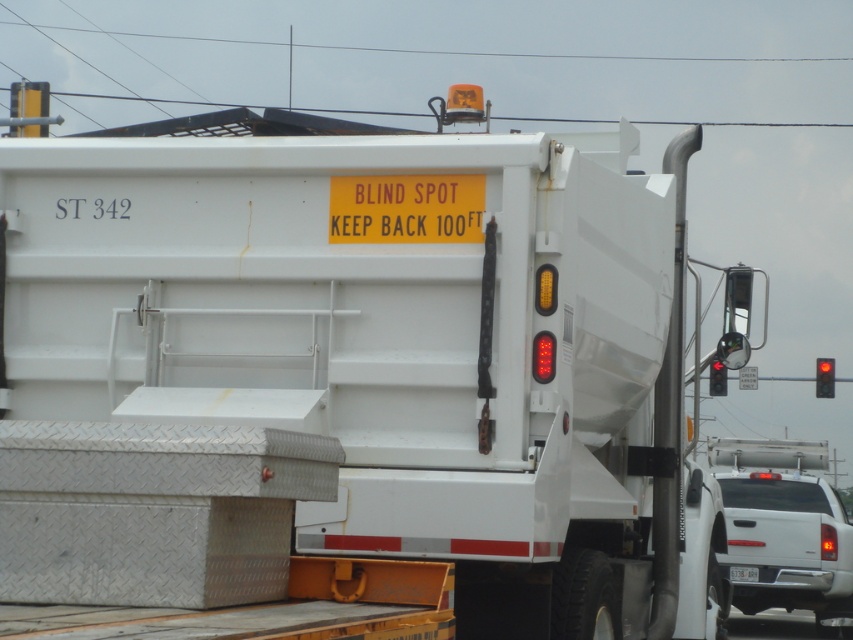
Question: Considering the real-world distances, which object is closest to the red glass traffic light at upper right?

Choices:
 (A) white glossy truck at lower right
 (B) white plastic license plate at center
 (C) black wire at upper center
 (D) red glass traffic light at right

Answer: (A)

Question: Does black wire at upper center have a smaller size compared to red glass traffic light at upper right?

Choices:
 (A) no
 (B) yes

Answer: (A)

Question: Is white glossy truck at lower right to the left of white plastic license plate at center from the viewer's perspective?

Choices:
 (A) yes
 (B) no

Answer: (B)

Question: Which is farther from the red glass traffic light at upper right?

Choices:
 (A) black wire at upper center
 (B) white glossy truck at lower right
 (C) red glass traffic light at right
 (D) white plastic license plate at center

Answer: (A)

Question: Which object is farther from the camera taking this photo?

Choices:
 (A) white glossy truck at lower right
 (B) red glass traffic light at upper right
 (C) red glass traffic light at right
 (D) black wire at upper center

Answer: (C)

Question: Is white glossy truck at lower right thinner than red glass traffic light at upper right?

Choices:
 (A) yes
 (B) no

Answer: (A)